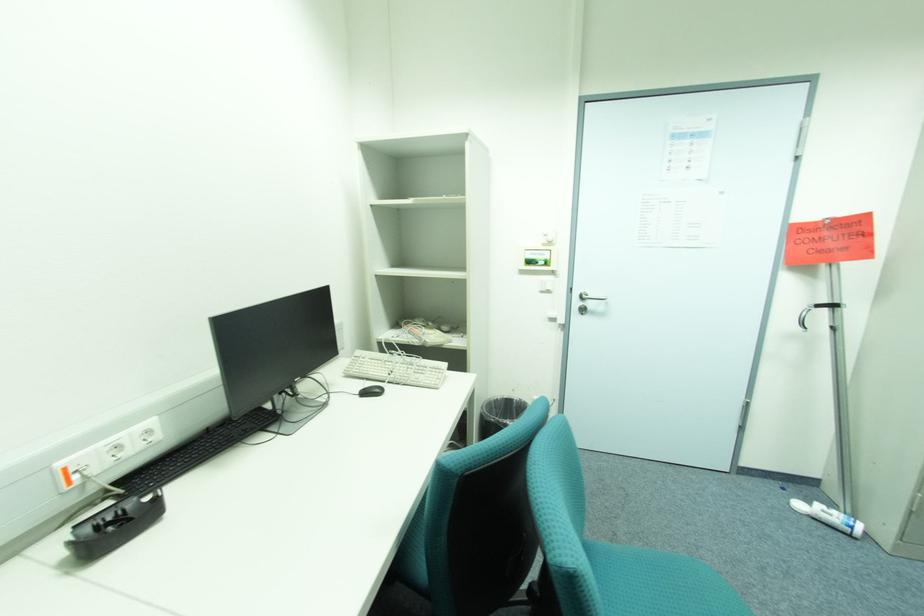
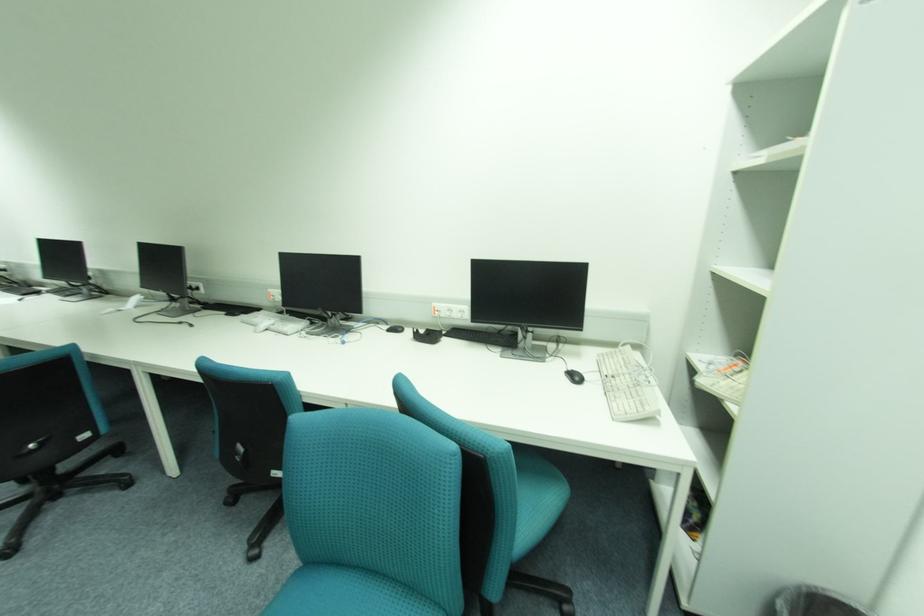
The point at [67,464] is marked in the first image. Where is the corresponding point in the second image?

(441, 305)